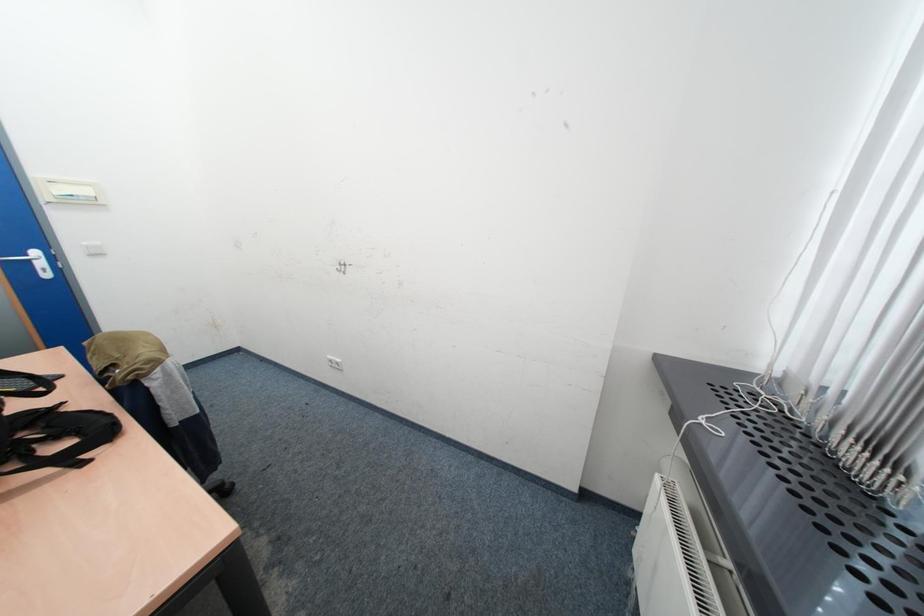
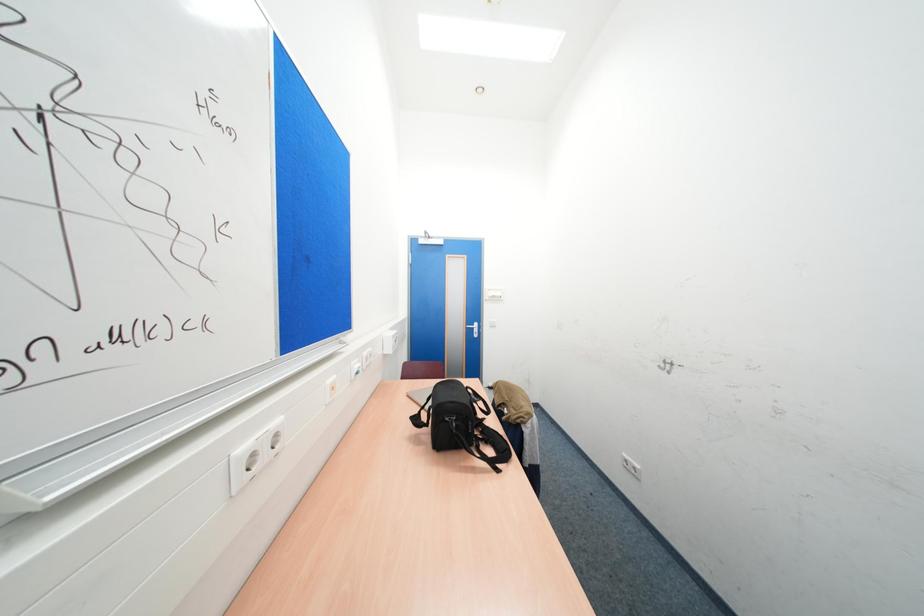
Question: The images are taken continuously from a first-person perspective. In which direction is your viewpoint rotating?

Choices:
 (A) Left
 (B) Right
 (C) Up
 (D) Down

Answer: (A)